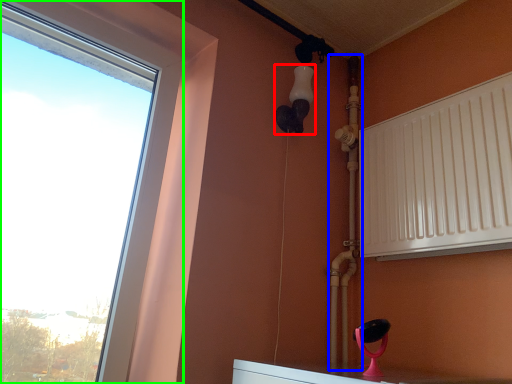
Question: Considering the real-world distances, which object is closest to light fixture (highlighted by a red box)? pipe (highlighted by a blue box) or window (highlighted by a green box).

Choices:
 (A) pipe
 (B) window

Answer: (A)